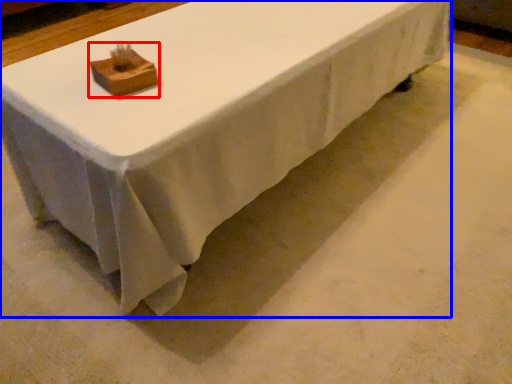
Question: Which object is further to the camera taking this photo, block (highlighted by a red box) or table (highlighted by a blue box)?

Choices:
 (A) block
 (B) table

Answer: (A)